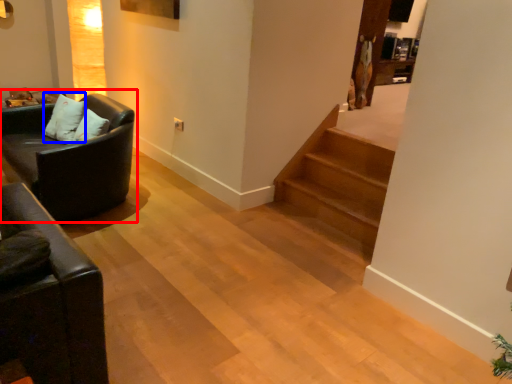
Question: Among these objects, which one is nearest to the camera, studio couch (highlighted by a red box) or pillow (highlighted by a blue box)?

Choices:
 (A) studio couch
 (B) pillow

Answer: (A)